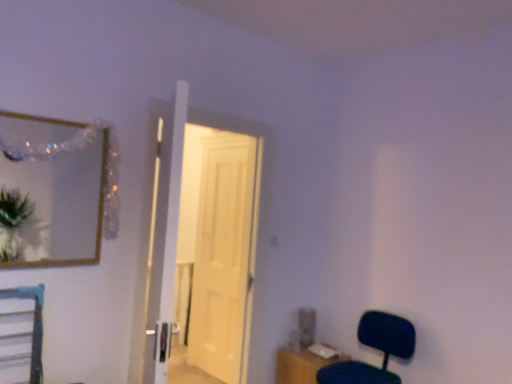
Question: From the image's perspective, would you say matte black chair at lower right is positioned over white wooden door at center, which appears as the first door when viewed from the front?

Choices:
 (A) no
 (B) yes

Answer: (A)

Question: Is white wooden door at center, which appears as the first door when viewed from the front, inside matte black chair at lower right?

Choices:
 (A) yes
 (B) no

Answer: (B)

Question: Is matte black chair at lower right behind white wooden door at center, which appears as the first door when viewed from the front?

Choices:
 (A) no
 (B) yes

Answer: (A)

Question: Is matte black chair at lower right at the right side of white wooden door at center, which appears as the first door when viewed from the front?

Choices:
 (A) no
 (B) yes

Answer: (B)

Question: Does matte black chair at lower right have a lesser height compared to white wooden door at center, which appears as the first door when viewed from the front?

Choices:
 (A) yes
 (B) no

Answer: (A)

Question: Looking at their shapes, would you say wooden frame mirror at upper left is wider or thinner than white glossy door at center, the 2th door positioned from the front?

Choices:
 (A) wide
 (B) thin

Answer: (A)

Question: From the image's perspective, is wooden frame mirror at upper left above or below white glossy door at center, which ranks as the 1th door in back-to-front order?

Choices:
 (A) below
 (B) above

Answer: (B)

Question: Is wooden frame mirror at upper left spatially inside white glossy door at center, which ranks as the 1th door in back-to-front order, or outside of it?

Choices:
 (A) inside
 (B) outside

Answer: (B)

Question: Relative to white glossy door at center, the 2th door positioned from the front, is wooden frame mirror at upper left in front or behind?

Choices:
 (A) front
 (B) behind

Answer: (A)

Question: Is white wooden door at center, the second door from the back, in front of or behind wooden table at lower right in the image?

Choices:
 (A) behind
 (B) front

Answer: (B)

Question: Considering the positions of white wooden door at center, which appears as the first door when viewed from the front, and wooden table at lower right in the image, is white wooden door at center, which appears as the first door when viewed from the front, bigger or smaller than wooden table at lower right?

Choices:
 (A) big
 (B) small

Answer: (A)

Question: Is white wooden door at center, the second door from the back, wider or thinner than wooden table at lower right?

Choices:
 (A) wide
 (B) thin

Answer: (B)

Question: In terms of height, does white wooden door at center, the second door from the back, look taller or shorter compared to wooden table at lower right?

Choices:
 (A) short
 (B) tall

Answer: (B)

Question: Considering the positions of wooden frame mirror at upper left and matte black chair at lower right in the image, is wooden frame mirror at upper left wider or thinner than matte black chair at lower right?

Choices:
 (A) wide
 (B) thin

Answer: (B)

Question: From a real-world perspective, is wooden frame mirror at upper left physically located above or below matte black chair at lower right?

Choices:
 (A) above
 (B) below

Answer: (A)